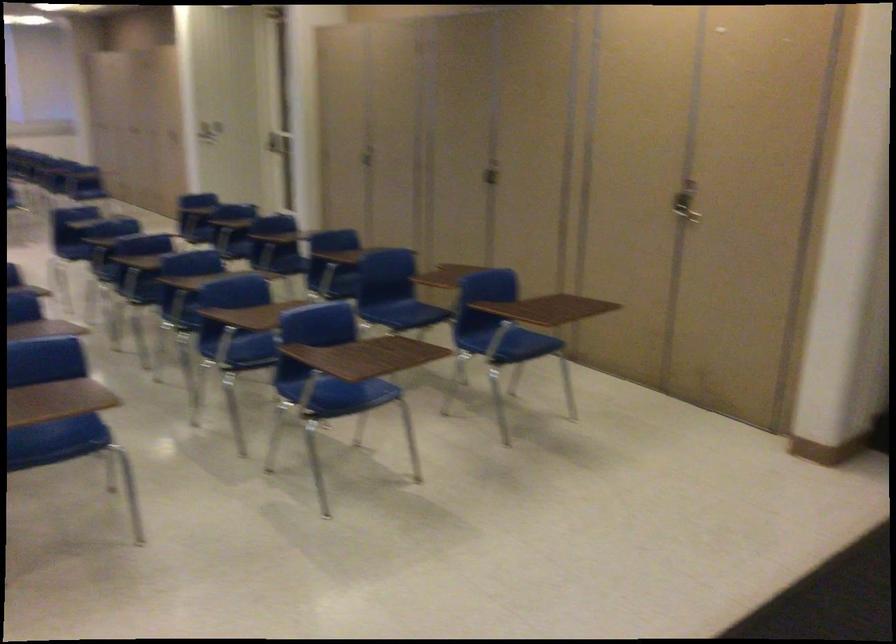
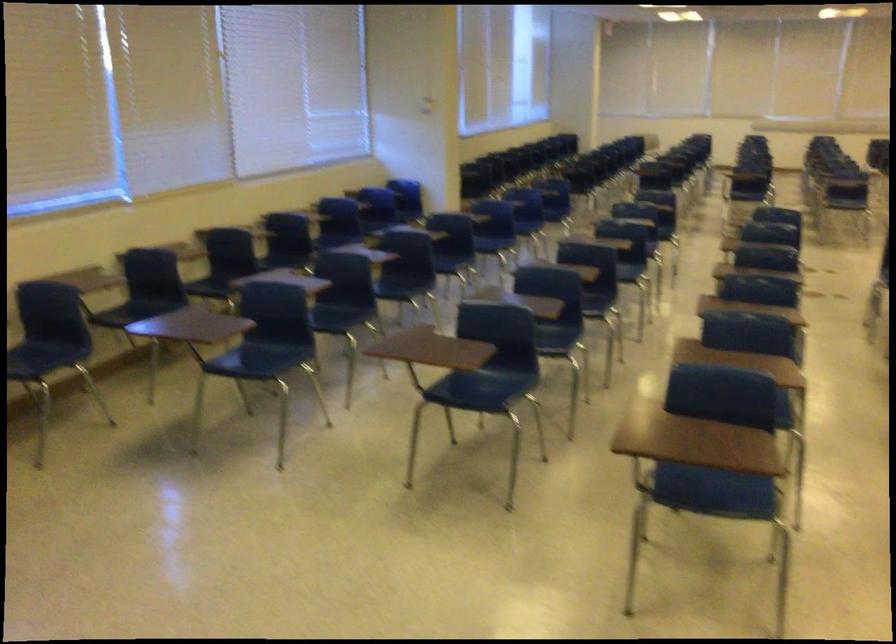
Question: Based on the continuous images, in which direction is the camera rotating? Reply with the corresponding letter.

Choices:
 (A) Left
 (B) Right
 (C) Up
 (D) Down

Answer: (A)